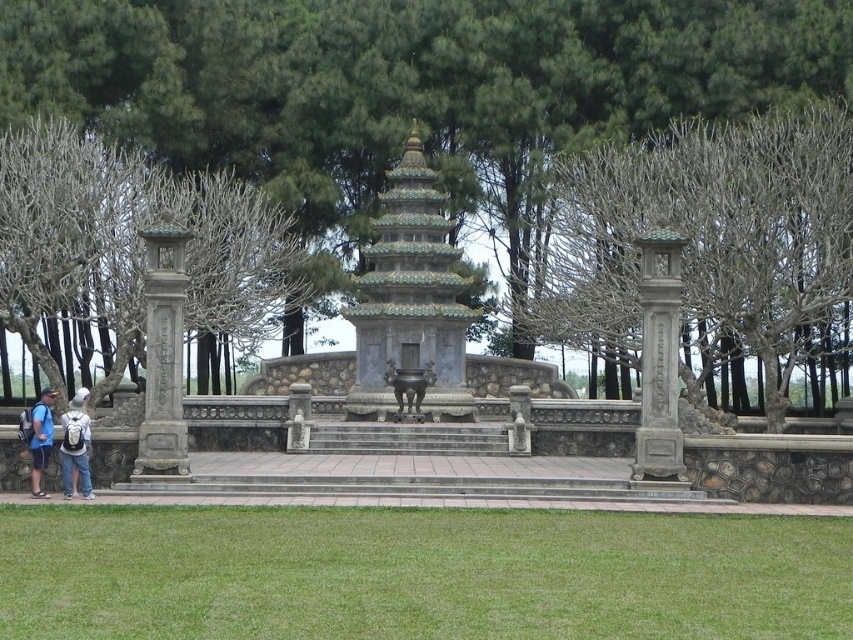
Question: Which point is closer to the camera taking this photo?

Choices:
 (A) (169, 374)
 (B) (123, 188)

Answer: (A)

Question: In this image, where is gray stone pillar at left located relative to denim jacket at lower left?

Choices:
 (A) above
 (B) below

Answer: (A)

Question: Does bare branches at center have a greater width compared to denim jacket at lower left?

Choices:
 (A) yes
 (B) no

Answer: (A)

Question: Which is farther from the gray stone pillar at left?

Choices:
 (A) gray stone pillar at right
 (B) denim shorts at lower left

Answer: (A)

Question: Which point appears farthest from the camera in this image?

Choices:
 (A) (258, 150)
 (B) (33, 426)
 (C) (68, 452)
 (D) (86, 220)

Answer: (A)

Question: Is bare branches at center smaller than matte gray backpack at lower left?

Choices:
 (A) no
 (B) yes

Answer: (A)